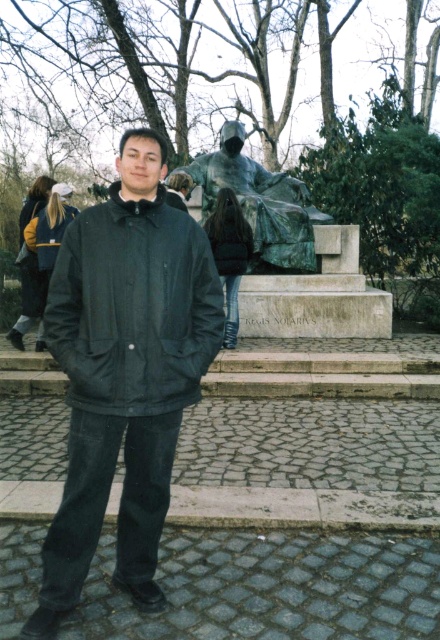
You are a photographer trying to capture the statue in the background. The matte black jacket at center is blocking your view. Where should you move to ensure the statue is fully visible?

Since the matte black jacket at center is located at point (124,372), moving to either the left or right side of the jacket would allow the statue in the background to come into full view.

You are a photographer trying to capture a photo of both the black matte jacket at center and the bronze statue at center. Based on their sizes, which one should you focus on first to ensure both are in frame?

The black matte jacket at center has a smaller size compared to the bronze statue at center, so you should focus on the bronze statue at center first to ensure both fit in the frame.